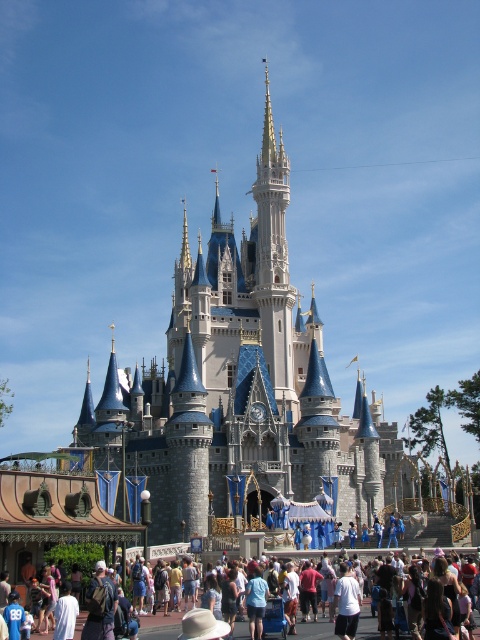
Question: Is white stone castle at center above multicolored casual attire at center?

Choices:
 (A) yes
 (B) no

Answer: (A)

Question: Which object is closer to the camera taking this photo?

Choices:
 (A) white stone castle at center
 (B) multicolored casual attire at center

Answer: (B)

Question: Can you confirm if white stone castle at center is bigger than multicolored casual attire at center?

Choices:
 (A) no
 (B) yes

Answer: (B)

Question: Is white stone castle at center above multicolored casual attire at center?

Choices:
 (A) yes
 (B) no

Answer: (A)

Question: Among these objects, which one is farthest from the camera?

Choices:
 (A) white stone castle at center
 (B) multicolored casual attire at center

Answer: (A)